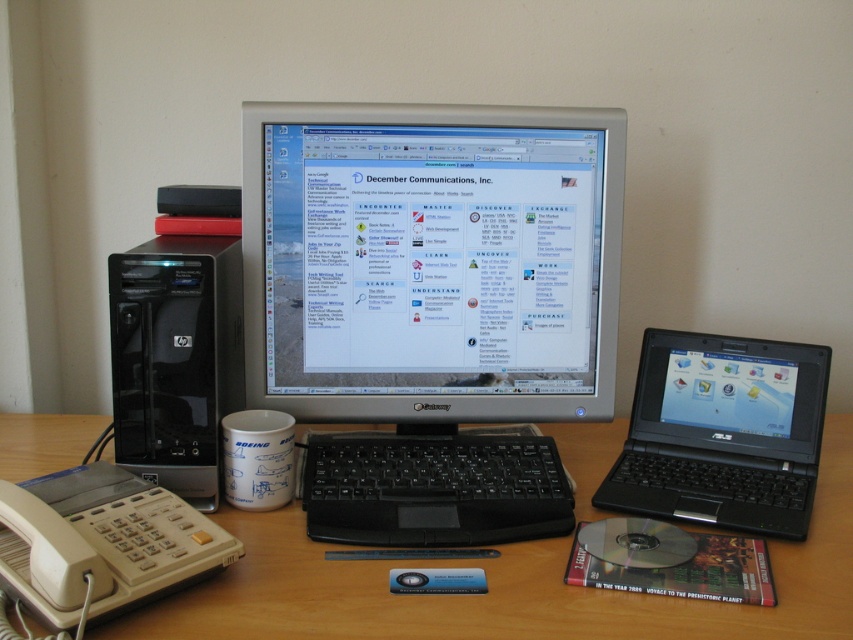
Question: Among these points, which one is nearest to the camera?

Choices:
 (A) (405, 220)
 (B) (402, 476)
 (C) (109, 634)

Answer: (C)

Question: Does silver/black plastic monitor at center appear over black plastic computer tower at left?

Choices:
 (A) yes
 (B) no

Answer: (A)

Question: Does black plastic laptop at right appear under black plastic keyboard at center?

Choices:
 (A) no
 (B) yes

Answer: (A)

Question: Which point is closer to the camera?

Choices:
 (A) wooden desk at center
 (B) black plastic keyboard at center
 (C) silver/black plastic monitor at center

Answer: (A)

Question: Which is farther from the wooden desk at center?

Choices:
 (A) black plastic keyboard at center
 (B) black plastic computer tower at left

Answer: (B)

Question: Does wooden desk at center appear under black plastic keyboard at center?

Choices:
 (A) no
 (B) yes

Answer: (B)